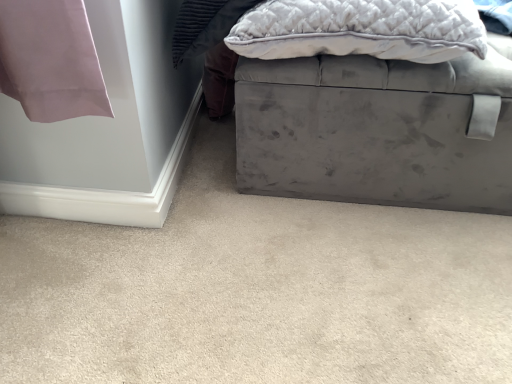
Question: From the image's perspective, is velvet gray ottoman at lower right over velvet gray ottoman at center?

Choices:
 (A) no
 (B) yes

Answer: (A)

Question: Does velvet gray ottoman at lower right have a larger size compared to velvet gray ottoman at center?

Choices:
 (A) no
 (B) yes

Answer: (A)

Question: Is velvet gray ottoman at lower right positioned behind velvet gray ottoman at center?

Choices:
 (A) yes
 (B) no

Answer: (B)

Question: Is velvet gray ottoman at lower right next to velvet gray ottoman at center and touching it?

Choices:
 (A) no
 (B) yes

Answer: (A)

Question: Does velvet gray ottoman at lower right contain velvet gray ottoman at center?

Choices:
 (A) yes
 (B) no

Answer: (B)

Question: From a real-world perspective, is velvet gray ottoman at lower right under velvet gray ottoman at center?

Choices:
 (A) no
 (B) yes

Answer: (B)

Question: Is velvet gray pillow at upper right placed right next to velvet gray ottoman at lower right?

Choices:
 (A) yes
 (B) no

Answer: (B)

Question: From the image's perspective, would you say velvet gray pillow at upper right is shown under velvet gray ottoman at lower right?

Choices:
 (A) no
 (B) yes

Answer: (A)

Question: Is velvet gray pillow at upper right completely or partially outside of velvet gray ottoman at lower right?

Choices:
 (A) no
 (B) yes

Answer: (B)

Question: Does velvet gray pillow at upper right come behind velvet gray ottoman at lower right?

Choices:
 (A) no
 (B) yes

Answer: (B)

Question: Can you confirm if velvet gray pillow at upper right is bigger than velvet gray ottoman at lower right?

Choices:
 (A) yes
 (B) no

Answer: (B)

Question: Does velvet gray pillow at upper right appear on the left side of velvet gray ottoman at lower right?

Choices:
 (A) yes
 (B) no

Answer: (B)

Question: Can velvet gray pillow at upper right be found inside velvet gray ottoman at lower right?

Choices:
 (A) no
 (B) yes

Answer: (A)